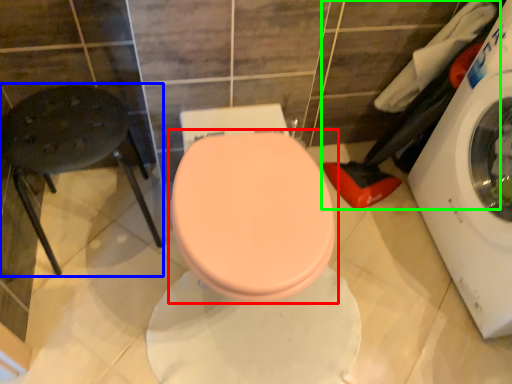
Question: Estimate the real-world distances between objects in this image. Which object is farther from toilet (highlighted by a red box), bar stool (highlighted by a blue box) or laundry (highlighted by a green box)?

Choices:
 (A) bar stool
 (B) laundry

Answer: (B)